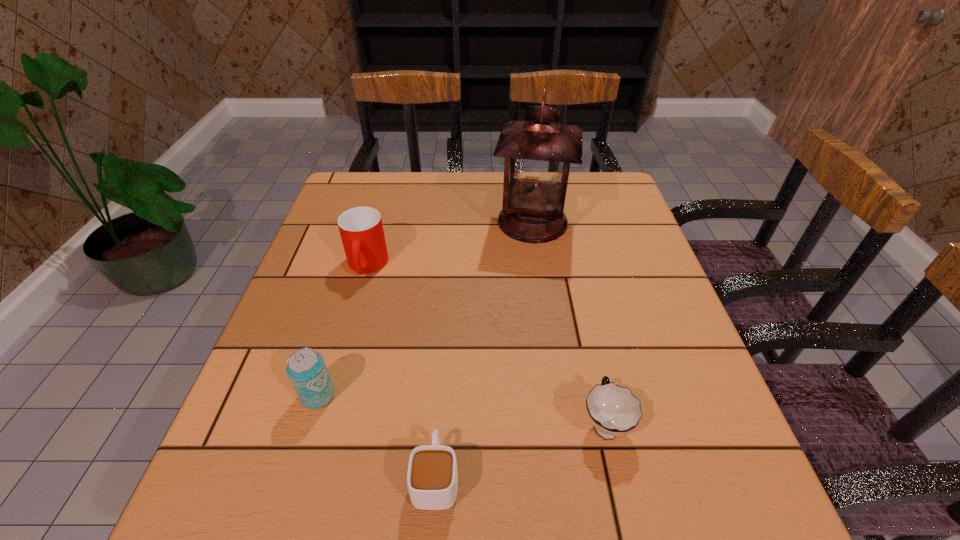
I want to click on the tallest object, so click(x=538, y=152).

This screenshot has height=540, width=960. I want to click on the farthest cup, so click(x=361, y=229).

Identify the location of the tallest cup. (361, 229).

At what (x,y) coordinates should I click in order to perform the action: click on the third tallest object. Please return your answer as a coordinate pair (x, y). This screenshot has width=960, height=540. Looking at the image, I should click on (306, 369).

Locate an element on the screen. Image resolution: width=960 pixels, height=540 pixels. the rightmost cup is located at coordinates click(x=613, y=410).

Where is `the third object from left to right`? the third object from left to right is located at coordinates (432, 478).

In order to click on free point located on the right of the oil lamp in this screenshot , I will do `click(600, 222)`.

Where is `free region located on the side of the tallest cup with the handle`? free region located on the side of the tallest cup with the handle is located at coordinates (338, 368).

This screenshot has width=960, height=540. I want to click on free region located 0.210m on the back of the third shortest object, so click(347, 301).

Where is `vacant region located 0.360m on the side of the rightmost cup with the handle`? vacant region located 0.360m on the side of the rightmost cup with the handle is located at coordinates [569, 265].